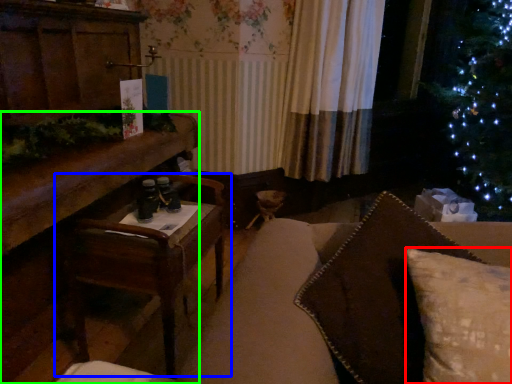
Question: Estimate the real-world distances between objects in this image. Which object is closer to pillow (highlighted by a red box), table (highlighted by a blue box) or furniture (highlighted by a green box)?

Choices:
 (A) table
 (B) furniture

Answer: (A)